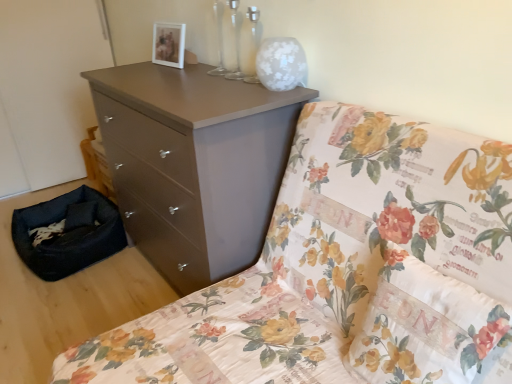
Question: Is matte brown chest of drawers at upper center far from matte brown dresser at center?

Choices:
 (A) no
 (B) yes

Answer: (A)

Question: Is matte brown chest of drawers at upper center closer to camera compared to matte brown dresser at center?

Choices:
 (A) no
 (B) yes

Answer: (A)

Question: From a real-world perspective, is matte brown chest of drawers at upper center below matte brown dresser at center?

Choices:
 (A) yes
 (B) no

Answer: (A)

Question: Does matte brown chest of drawers at upper center have a lesser width compared to matte brown dresser at center?

Choices:
 (A) no
 (B) yes

Answer: (B)

Question: Considering the relative positions of matte brown chest of drawers at upper center and matte brown dresser at center in the image provided, is matte brown chest of drawers at upper center behind matte brown dresser at center?

Choices:
 (A) no
 (B) yes

Answer: (B)

Question: Does point (80, 241) appear closer or farther from the camera than point (379, 375)?

Choices:
 (A) farther
 (B) closer

Answer: (A)

Question: Looking at their shapes, would you say black fabric pet bed at lower left is wider or thinner than floral fabric pillow at center?

Choices:
 (A) thin
 (B) wide

Answer: (B)

Question: Choose the correct answer: Is black fabric pet bed at lower left inside floral fabric pillow at center or outside it?

Choices:
 (A) outside
 (B) inside

Answer: (A)

Question: Is black fabric pet bed at lower left to the left or to the right of floral fabric pillow at center in the image?

Choices:
 (A) left
 (B) right

Answer: (A)

Question: Which is correct: black fabric pet bed at lower left is inside matte brown dresser at center, or outside of it?

Choices:
 (A) inside
 (B) outside

Answer: (B)

Question: From a real-world perspective, relative to matte brown dresser at center, is black fabric pet bed at lower left vertically above or below?

Choices:
 (A) above
 (B) below

Answer: (B)

Question: In terms of width, does black fabric pet bed at lower left look wider or thinner when compared to matte brown dresser at center?

Choices:
 (A) thin
 (B) wide

Answer: (A)

Question: Considering the positions of black fabric pet bed at lower left and matte brown dresser at center in the image, is black fabric pet bed at lower left bigger or smaller than matte brown dresser at center?

Choices:
 (A) small
 (B) big

Answer: (A)

Question: Is matte brown chest of drawers at upper center inside the boundaries of matte brown dresser at center, or outside?

Choices:
 (A) inside
 (B) outside

Answer: (B)

Question: In terms of width, does matte brown chest of drawers at upper center look wider or thinner when compared to matte brown dresser at center?

Choices:
 (A) wide
 (B) thin

Answer: (B)